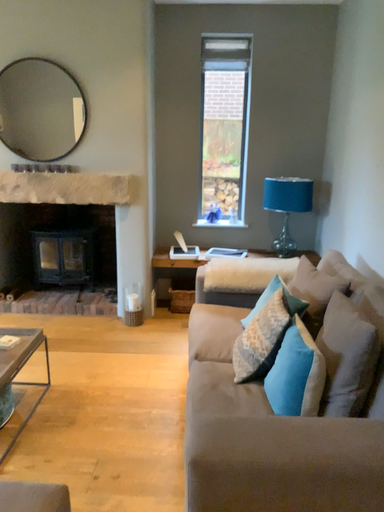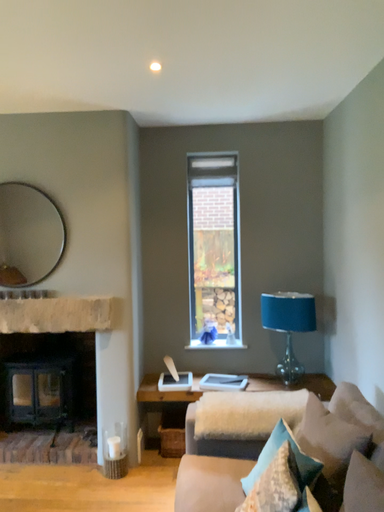
Question: How did the camera likely rotate when shooting the video?

Choices:
 (A) rotated downward
 (B) rotated upward

Answer: (B)